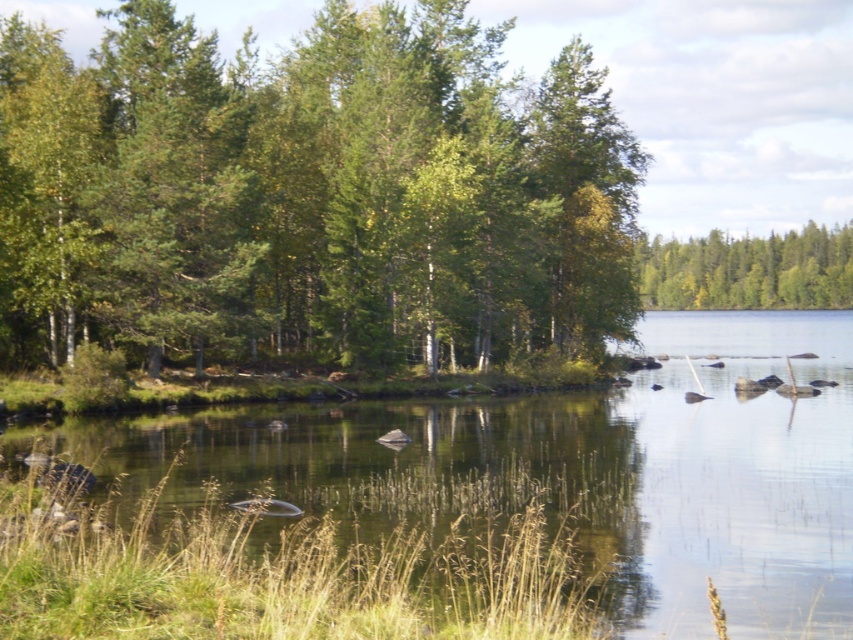
Does green leafy trees at center have a lesser width compared to green leafy trees at upper right?

No, green leafy trees at center is not thinner than green leafy trees at upper right.

Is green leafy trees at center smaller than green leafy trees at upper right?

No, green leafy trees at center is not smaller than green leafy trees at upper right.

Which is behind, point (311, 163) or point (825, 259)?

The point (825, 259) is more distant.

Locate an element on the screen. green leafy trees at center is located at coordinates (310, 195).